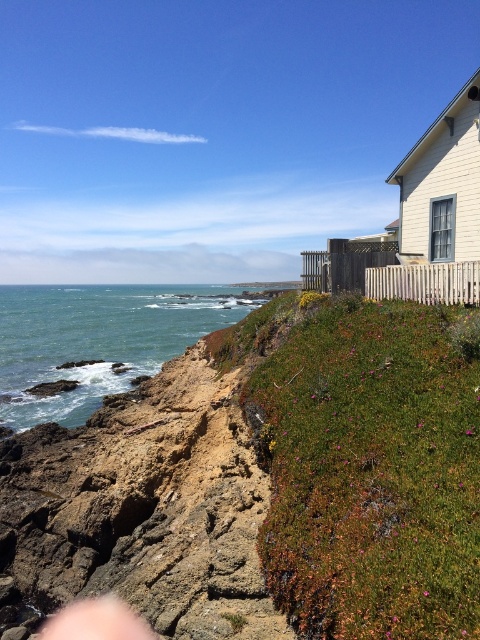
Question: Which of the following is the farthest from the observer?

Choices:
 (A) green water at lower left
 (B) green grassy hillside at upper right

Answer: (A)

Question: From the image, what is the correct spatial relationship of green grassy hillside at upper right in relation to green water at lower left?

Choices:
 (A) above
 (B) below

Answer: (B)

Question: Is green grassy hillside at upper right behind green water at lower left?

Choices:
 (A) no
 (B) yes

Answer: (A)

Question: Which point is farther to the camera?

Choices:
 (A) (17, 346)
 (B) (468, 580)

Answer: (A)

Question: Can you confirm if green grassy hillside at upper right is positioned below green water at lower left?

Choices:
 (A) no
 (B) yes

Answer: (B)